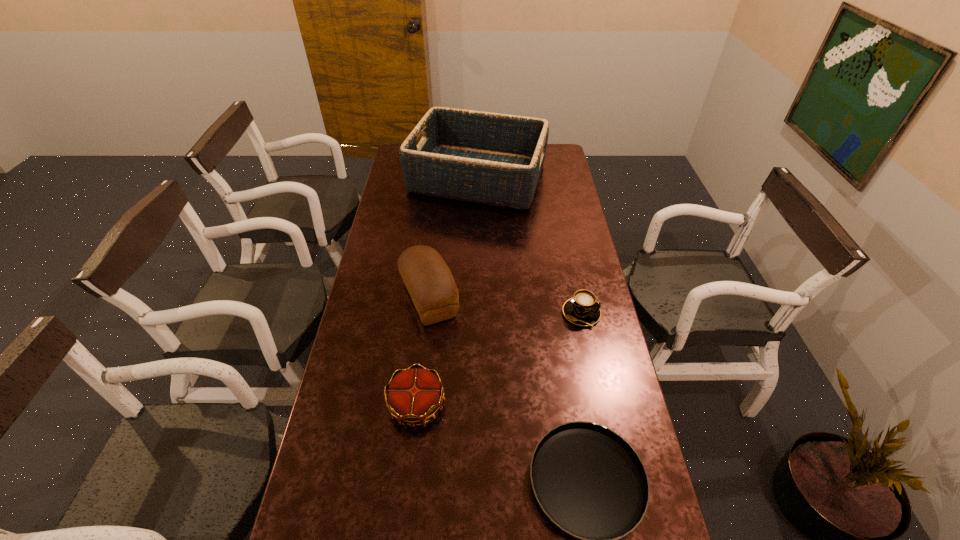
This screenshot has width=960, height=540. What are the coordinates of `blank region between the bread and the cappuccino` in the screenshot? It's located at (505, 306).

Where is `vacant region between the second tallest object and the crown`? The image size is (960, 540). vacant region between the second tallest object and the crown is located at coordinates (423, 352).

This screenshot has height=540, width=960. Identify the location of unoccupied area between the cappuccino and the second tallest object. pyautogui.click(x=505, y=306).

Locate which object is the third closest to the farthest object. Please provide its 2D coordinates. Your answer should be formatted as a tuple, i.e. [(x, y)], where the tuple contains the x and y coordinates of a point satisfying the conditions above.

[(414, 395)]

Locate which object is the fourth closest to the cappuccino. Please provide its 2D coordinates. Your answer should be formatted as a tuple, i.e. [(x, y)], where the tuple contains the x and y coordinates of a point satisfying the conditions above.

[(496, 159)]

I want to click on vacant space that satisfies the following two spatial constraints: 1. on the back side of the cappuccino; 2. on the right side of the crown, so click(x=427, y=313).

At what (x,y) coordinates should I click in order to perform the action: click on free space that satisfies the following two spatial constraints: 1. on the back side of the bread; 2. on the right side of the farthest object. Please return your answer as a coordinate pair (x, y). The height and width of the screenshot is (540, 960). Looking at the image, I should click on (443, 177).

This screenshot has width=960, height=540. I want to click on free location that satisfies the following two spatial constraints: 1. on the back side of the crown; 2. on the right side of the cappuccino, so click(427, 313).

This screenshot has width=960, height=540. What are the coordinates of `free space that satisfies the following two spatial constraints: 1. on the back side of the crown; 2. on the left side of the fourth shortest object` in the screenshot? It's located at (428, 299).

At what (x,y) coordinates should I click in order to perform the action: click on free space in the image that satisfies the following two spatial constraints: 1. on the front side of the farthest object; 2. on the left side of the cappuccino. Please return your answer as a coordinate pair (x, y). The width and height of the screenshot is (960, 540). Looking at the image, I should click on (477, 313).